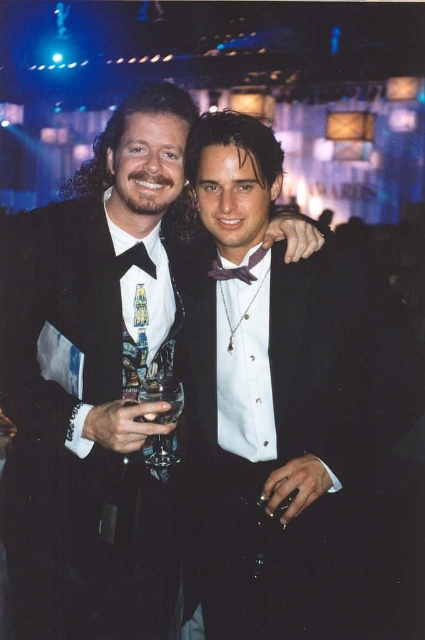
You are a photographer setting up for a formal event. You need to position a spotlight so that it illuminates the matte black tuxedo at center without casting a shadow on the black satin bow tie at left. Is this possible given their current positions?

The matte black tuxedo at center is in front of the black satin bow tie at left. Since the tuxedo is in front, positioning the spotlight appropriately could illuminate the tuxedo while the bow tie, being behind, might not be in the direct light path. However, the exact feasibility depends on the angle and placement of the spotlight relative to both objects.

You are a photographer at a formal event. You need to capture a closeup shot of the black satin tuxedo at center and the black satin bow tie at left. Which one should you focus on to ensure it fills the frame more?

The black satin tuxedo at center is bigger than the black satin bow tie at left, so focusing on the black satin tuxedo at center will ensure it fills the frame more.

You are a photographer at a formal event. You need to capture a photo of the matte black tuxedo at center and the black satin bow tie at left. If you want to ensure both are in focus, which one should you focus on first?

The matte black tuxedo at center is taller than the black satin bow tie at left, so focusing on the taller object first would help ensure both are in focus.